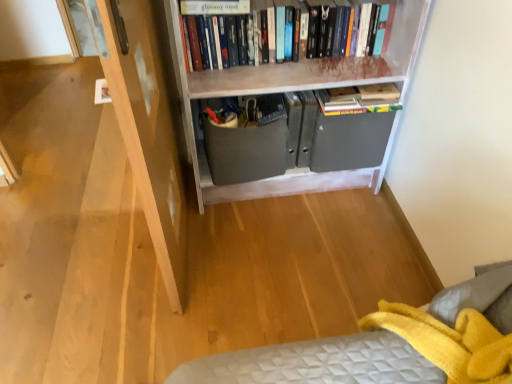
Question: From the image's perspective, is hardcover books at upper center located above or below white painted wood bookcase at upper center?

Choices:
 (A) below
 (B) above

Answer: (B)

Question: Is point (295, 18) closer or farther from the camera than point (214, 82)?

Choices:
 (A) closer
 (B) farther

Answer: (A)

Question: Estimate the real-world distances between objects in this image. Which object is closer to the white painted wood bookcase at upper center?

Choices:
 (A) hardcover book at upper center
 (B) hardcover books at upper center
 (C) matte gray drawer at center

Answer: (B)

Question: Which of these objects is positioned closest to the hardcover book at upper center?

Choices:
 (A) white painted wood bookcase at upper center
 (B) matte gray drawer at center
 (C) hardcover books at upper center

Answer: (C)